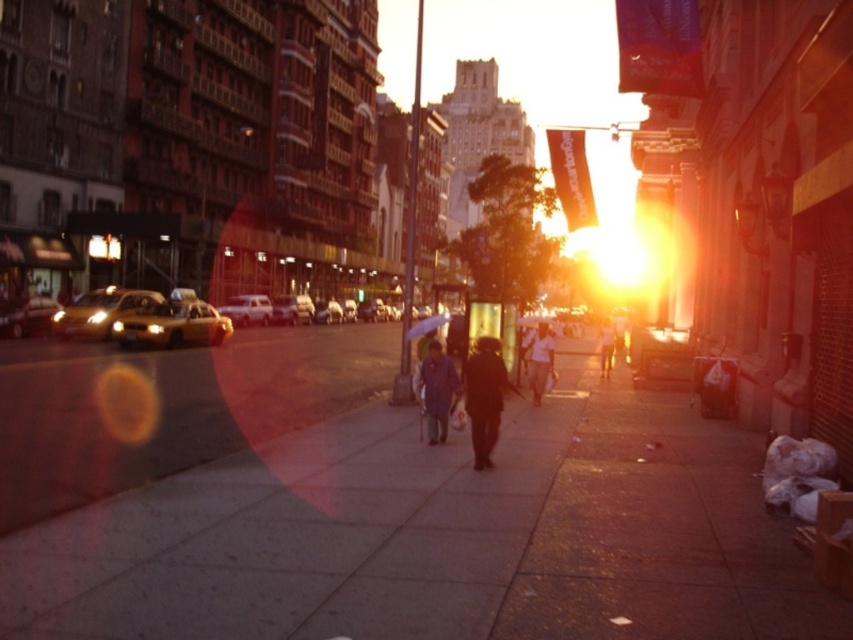
Question: Which point appears farthest from the camera in this image?

Choices:
 (A) (761, 608)
 (B) (424, 378)
 (C) (265, 317)

Answer: (C)

Question: Is brown leather jacket at center bigger than white matte van at center?

Choices:
 (A) no
 (B) yes

Answer: (A)

Question: Does white matte shirt at center appear under transparent plastic umbrella at center?

Choices:
 (A) yes
 (B) no

Answer: (A)

Question: Which object is positioned closest to the dark matte jacket at center?

Choices:
 (A) white matte van at center
 (B) yellow metallic taxi at center-left
 (C) concrete sidewalk at center
 (D) shiny metallic car at left

Answer: (C)

Question: Is brown leather jacket at center to the left of transparent plastic umbrella at center from the viewer's perspective?

Choices:
 (A) no
 (B) yes

Answer: (A)

Question: Considering the real-world distances, which object is farthest from the transparent plastic umbrella at center?

Choices:
 (A) yellow rubber taxi at left
 (B) dark gray jacket at center

Answer: (A)